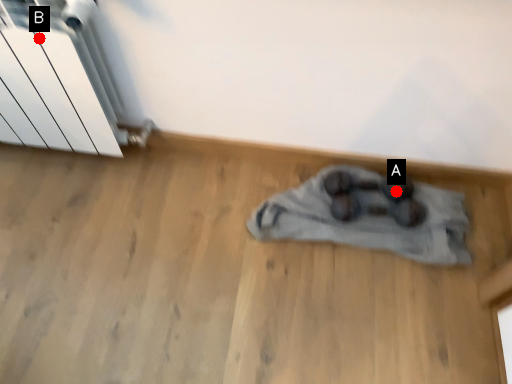
Question: Two points are circled on the image, labeled by A and B beside each circle. Among these points, which one is nearest to the camera?

Choices:
 (A) A is closer
 (B) B is closer

Answer: (B)